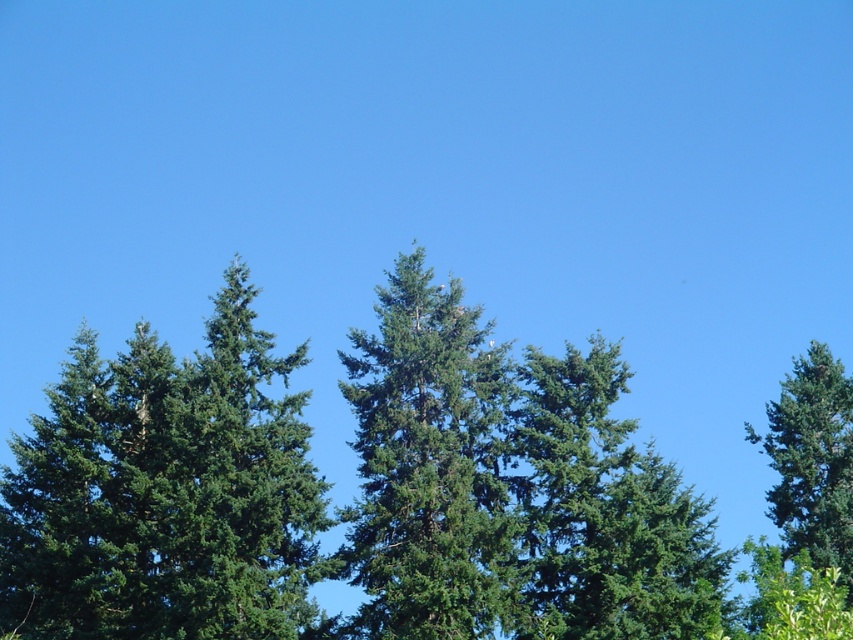
Does green needle-like at upper left appear on the right side of green textured tree at right?

No, green needle-like at upper left is not to the right of green textured tree at right.

Based on the photo, how far apart are green needle-like at upper left and green textured tree at right?

They are 25.21 meters apart.

Between point (57, 564) and point (830, 481), which one is positioned in front?

Point (57, 564) is in front.

Locate an element on the screen. green needle-like at upper left is located at coordinates (164, 492).

Where is `green matte tree at center`? This screenshot has width=853, height=640. green matte tree at center is located at coordinates (428, 465).

Who is positioned more to the left, green matte tree at center or green textured tree at right?

green matte tree at center is more to the left.

Image resolution: width=853 pixels, height=640 pixels. I want to click on green matte tree at center, so click(x=428, y=465).

At what (x,y) coordinates should I click in order to perform the action: click on green matte tree at center. Please return your answer as a coordinate pair (x, y). Looking at the image, I should click on (428, 465).

Looking at this image, is green needle-like at upper left wider than green matte tree at center?

Indeed, green needle-like at upper left has a greater width compared to green matte tree at center.

Is green needle-like at upper left smaller than green matte tree at center?

No.

Is point (201, 630) more distant than point (467, 481)?

That is False.

Locate an element on the screen. Image resolution: width=853 pixels, height=640 pixels. green needle-like at upper left is located at coordinates (164, 492).